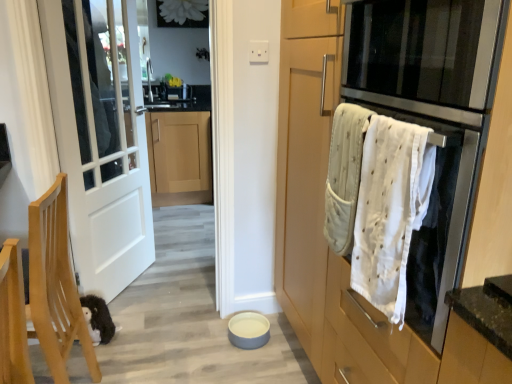
Question: Does white glossy sink at upper center have a greater height compared to light wood cabinet at center, which is the first cabinetry in back-to-front order?

Choices:
 (A) no
 (B) yes

Answer: (A)

Question: Would you say light wood cabinet at center, placed as the 2th cabinetry when sorted from front to back, is part of white glossy sink at upper center's contents?

Choices:
 (A) yes
 (B) no

Answer: (B)

Question: From the image's perspective, is white glossy sink at upper center over light wood cabinet at center, arranged as the first cabinetry when viewed from the left?

Choices:
 (A) yes
 (B) no

Answer: (A)

Question: Considering the relative positions of white glossy sink at upper center and light wood cabinet at center, arranged as the second cabinetry when viewed from the right, in the image provided, is white glossy sink at upper center to the right of light wood cabinet at center, arranged as the second cabinetry when viewed from the right, from the viewer's perspective?

Choices:
 (A) yes
 (B) no

Answer: (B)

Question: Is white glossy sink at upper center not inside light wood cabinet at center, arranged as the first cabinetry when viewed from the left?

Choices:
 (A) yes
 (B) no

Answer: (B)

Question: From the image's perspective, is white matte door at left located above or below matte wood cabinet at right, positioned as the first cabinetry in front-to-back order?

Choices:
 (A) below
 (B) above

Answer: (B)

Question: Is point (114, 294) closer or farther from the camera than point (424, 296)?

Choices:
 (A) farther
 (B) closer

Answer: (A)

Question: Visually, is white matte door at left positioned to the left or to the right of matte wood cabinet at right, which appears as the 2th cabinetry when viewed from the back?

Choices:
 (A) right
 (B) left

Answer: (B)

Question: Looking at the image, does white matte door at left seem bigger or smaller compared to matte wood cabinet at right, which appears as the 2th cabinetry when viewed from the back?

Choices:
 (A) small
 (B) big

Answer: (A)

Question: Based on their positions, is light wood cabinet at center, arranged as the second cabinetry when viewed from the right, located to the left or right of white glossy sink at upper center?

Choices:
 (A) right
 (B) left

Answer: (A)

Question: In terms of width, does light wood cabinet at center, arranged as the second cabinetry when viewed from the right, look wider or thinner when compared to white glossy sink at upper center?

Choices:
 (A) thin
 (B) wide

Answer: (B)

Question: From a real-world perspective, relative to white glossy sink at upper center, is light wood cabinet at center, placed as the 2th cabinetry when sorted from front to back, vertically above or below?

Choices:
 (A) below
 (B) above

Answer: (A)

Question: Is light wood cabinet at center, arranged as the second cabinetry when viewed from the right, in front of or behind white glossy sink at upper center in the image?

Choices:
 (A) behind
 (B) front

Answer: (B)

Question: Is light wood cabinet at center, placed as the 2th cabinetry when sorted from front to back, in front of or behind matte wood cabinet at right, which appears as the second cabinetry when viewed from the left, in the image?

Choices:
 (A) behind
 (B) front

Answer: (A)

Question: From a real-world perspective, is light wood cabinet at center, placed as the 2th cabinetry when sorted from front to back, above or below matte wood cabinet at right, which appears as the second cabinetry when viewed from the left?

Choices:
 (A) above
 (B) below

Answer: (B)